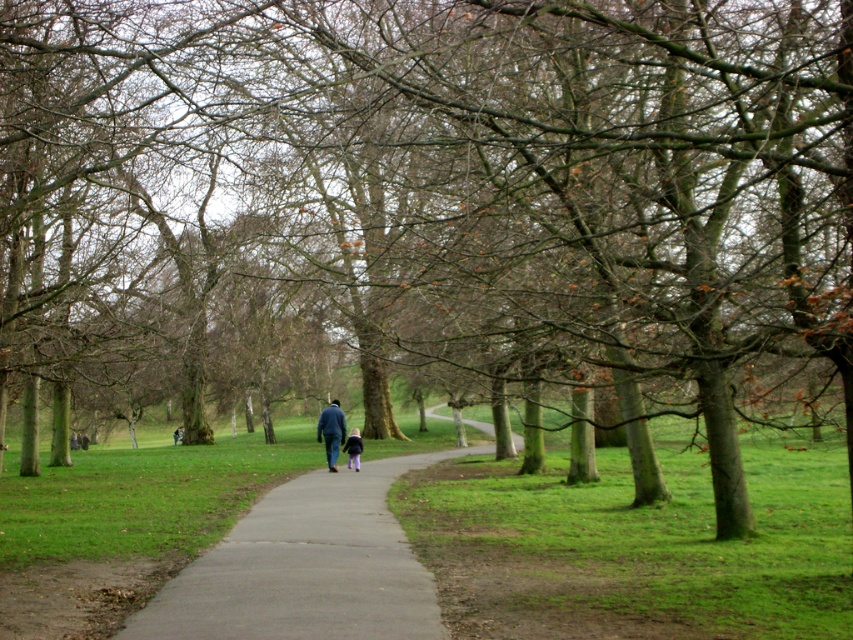
You are a photographer planning to take a portrait of a person wearing the blue fabric jacket at center and dark blue jeans at center. You want to ensure that both the jacket and jeans are clearly visible in the photo. Based on their sizes, which clothing item should you focus on to ensure both are in frame?

The blue fabric jacket at center has a larger width than the dark blue jeans at center, so focusing on the jacket will ensure both items are visible in the frame.

You are standing on the paved pathway in the park and see a person wearing a blue fabric jacket at center and dark blue jeans at center. Which piece of clothing is positioned to the left?

The blue fabric jacket at center is to the left of the dark blue jeans at center.